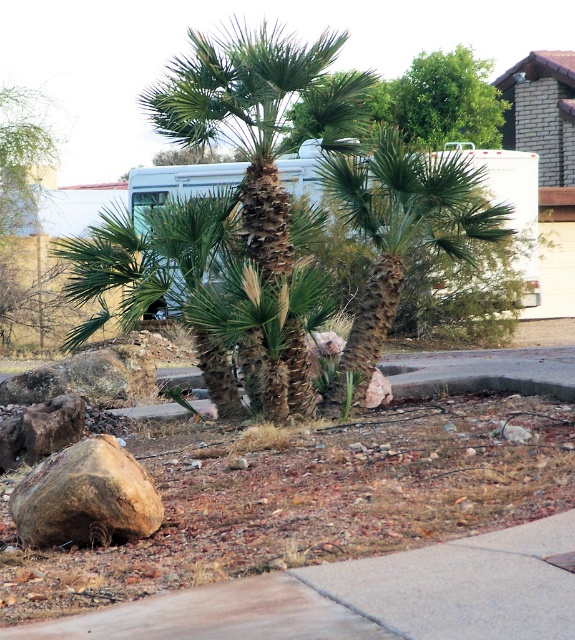
Question: Which object is the farthest from the brown rough boulder at lower left?

Choices:
 (A) concrete at lower center
 (B) white matte recreational vehicle at center
 (C) green textured palm tree at center

Answer: (B)

Question: Does concrete at lower center have a greater width compared to brown rough boulder at lower left?

Choices:
 (A) no
 (B) yes

Answer: (B)

Question: Is green leafy palm tree at center above brown rough boulder at lower left?

Choices:
 (A) no
 (B) yes

Answer: (B)

Question: Which object is closer to the camera taking this photo?

Choices:
 (A) green leafy tree at upper center
 (B) brown rough boulder at lower left
 (C) white matte recreational vehicle at center

Answer: (B)

Question: Can you confirm if green textured palm tree at center is positioned above green leafy tree at upper center?

Choices:
 (A) yes
 (B) no

Answer: (B)

Question: Which of the following is the closest to the observer?

Choices:
 (A) green leafy tree at upper center
 (B) green leafy palm tree at center

Answer: (B)